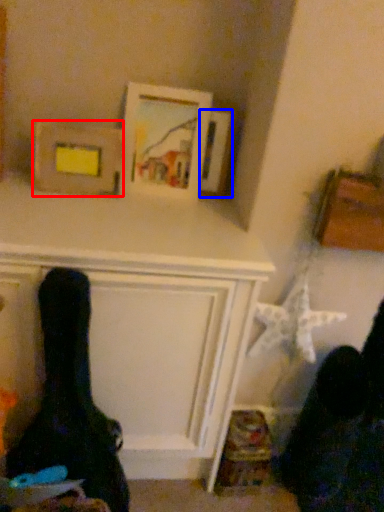
Question: Which object appears closest to the camera in this image, picture frame (highlighted by a red box) or picture frame (highlighted by a blue box)?

Choices:
 (A) picture frame
 (B) picture frame

Answer: (A)